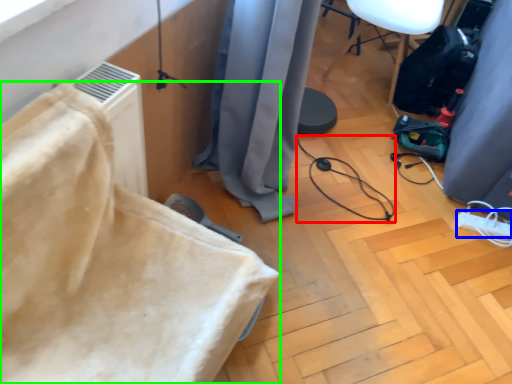
Question: Which object is positioned farthest from cable (highlighted by a red box)? Select from extension cord (highlighted by a blue box) and furniture (highlighted by a green box).

Choices:
 (A) extension cord
 (B) furniture

Answer: (B)